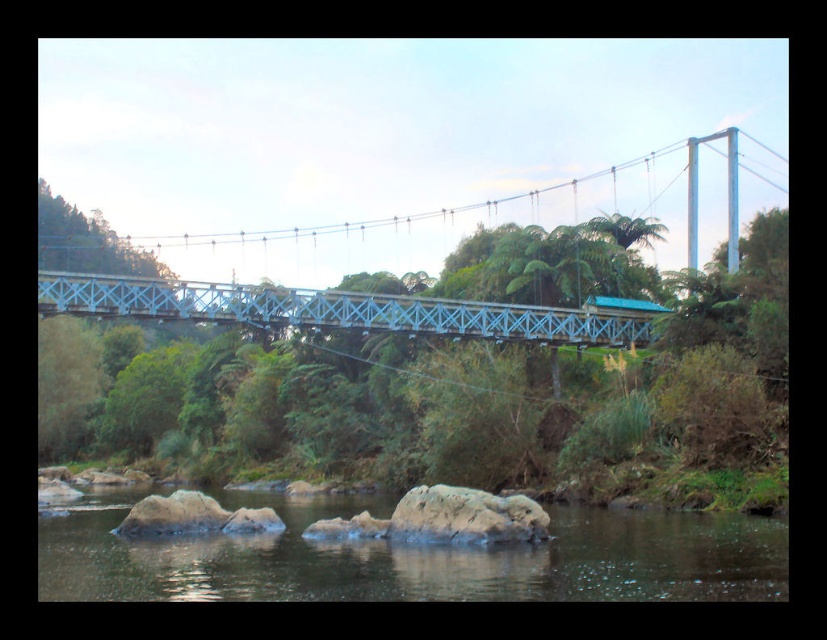
Does point (428, 580) come in front of point (170, 516)?

Yes, point (428, 580) is in front of point (170, 516).

Does point (343, 550) come behind point (151, 518)?

No, (343, 550) is closer to viewer.

Is point (103, 582) in front of point (189, 518)?

Yes, point (103, 582) is in front of point (189, 518).

The height and width of the screenshot is (640, 827). What are the coordinates of `smooth rock at lower center` in the screenshot? It's located at (410, 557).

Does point (156, 300) come farther from viewer compared to point (208, 506)?

Yes, point (156, 300) is farther from viewer.

Can you confirm if blue metallic bridge at center is wider than brown smooth rock at lower center?

Correct, the width of blue metallic bridge at center exceeds that of brown smooth rock at lower center.

The width and height of the screenshot is (827, 640). What are the coordinates of `blue metallic bridge at center` in the screenshot? It's located at (345, 308).

Can you confirm if smooth rock at lower center is taller than smooth gray rock at center?

Correct, smooth rock at lower center is much taller as smooth gray rock at center.

Between smooth rock at lower center and smooth gray rock at center, which one is positioned lower?

smooth rock at lower center is lower down.

Does point (278, 538) come in front of point (423, 499)?

No, it is behind (423, 499).

In order to click on smooth rock at lower center in this screenshot , I will do `click(410, 557)`.